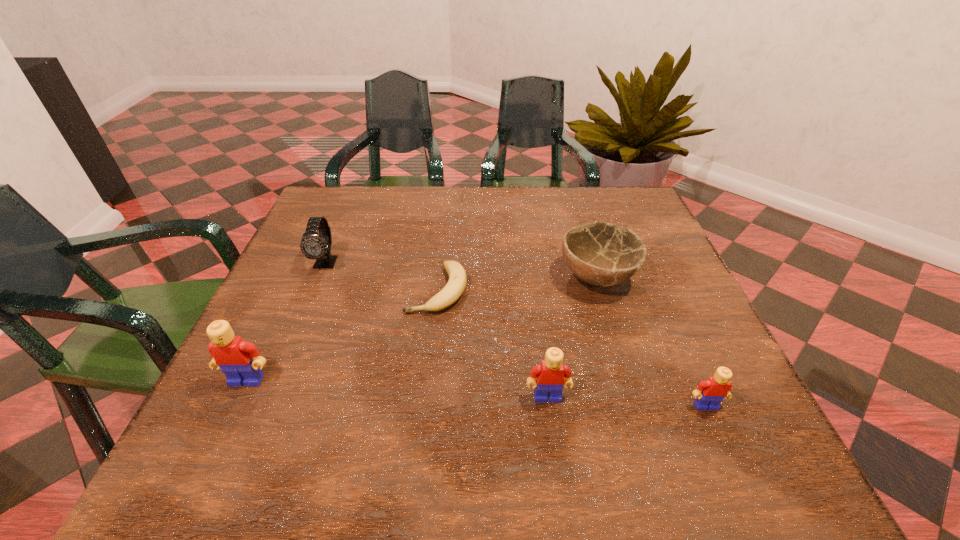
This screenshot has height=540, width=960. What are the coordinates of `the tallest object` in the screenshot? It's located at (240, 361).

This screenshot has height=540, width=960. I want to click on the third nearest object, so click(240, 361).

The height and width of the screenshot is (540, 960). Identify the location of the third object from right to left. (550, 374).

Identify the location of the second Lego from right to left. Image resolution: width=960 pixels, height=540 pixels. (550, 374).

Locate an element on the screen. The height and width of the screenshot is (540, 960). the rightmost Lego is located at coordinates (716, 388).

Where is `the rightmost object`? The image size is (960, 540). the rightmost object is located at coordinates (716, 388).

What are the coordinates of `banana` in the screenshot? It's located at (455, 287).

Locate an element on the screen. The width and height of the screenshot is (960, 540). the third object from left to right is located at coordinates (455, 287).

You are a GUI agent. You are given a task and a screenshot of the screen. Output one action in this format:
    pyautogui.click(x=<x>, y=<y>)
    Task: Click on the bowl
    
    Given the screenshot: What is the action you would take?
    pyautogui.click(x=601, y=254)

Image resolution: width=960 pixels, height=540 pixels. I want to click on watch, so click(x=314, y=245).